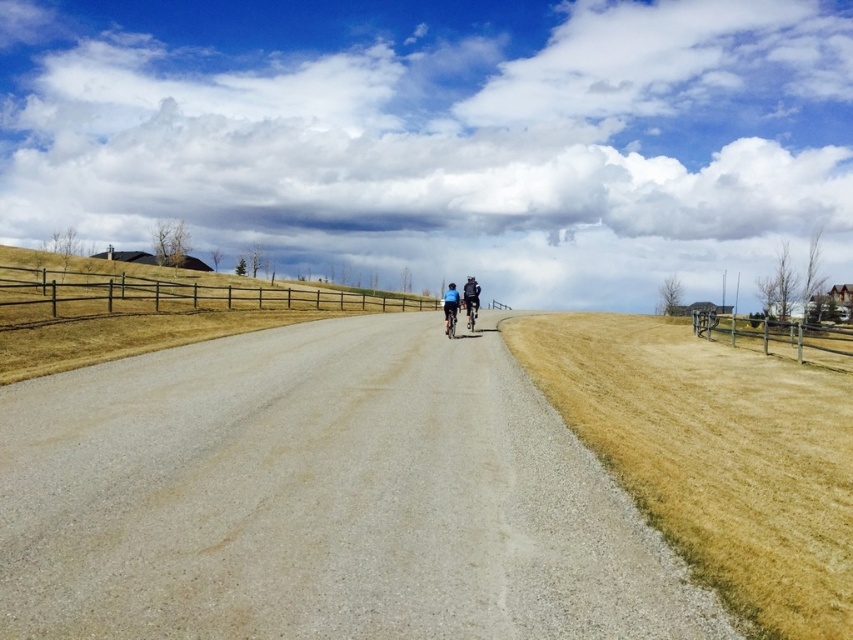
Question: Does blue fabric cyclist at center have a lesser width compared to shiny blue bicycle at center?

Choices:
 (A) yes
 (B) no

Answer: (B)

Question: Is wooden fence at right smaller than blue fabric cyclist at center?

Choices:
 (A) no
 (B) yes

Answer: (A)

Question: Which point is farther to the camera?

Choices:
 (A) blue fabric bicycle at center
 (B) brown wooden fence at left
 (C) dark blue fabric jacket at center

Answer: (C)

Question: Which point is closer to the camera taking this photo?

Choices:
 (A) [x=590, y=492]
 (B) [x=816, y=352]

Answer: (A)

Question: Which of the following is the closest to the observer?

Choices:
 (A) shiny blue bicycle at center
 (B) gray gravel road at center
 (C) brown wooden fence at left

Answer: (B)

Question: Does gray gravel road at center have a lesser width compared to wooden fence at right?

Choices:
 (A) yes
 (B) no

Answer: (A)